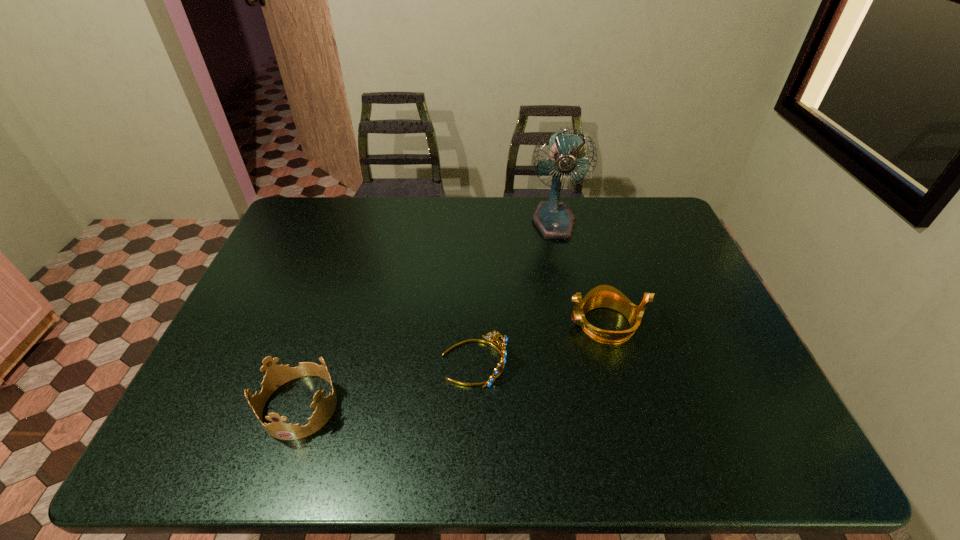
You are a GUI agent. You are given a task and a screenshot of the screen. Output one action in this format:
    pyautogui.click(x=<x>, y=<y>)
    Task: Click on the object located in the far edge section of the desktop
    This screenshot has height=540, width=960.
    Given the screenshot: What is the action you would take?
    pyautogui.click(x=554, y=220)

Locate an element on the screen. The image size is (960, 540). object that is at the near edge is located at coordinates (276, 375).

Identify the location of free spot at the far edge of the desktop. This screenshot has width=960, height=540. (433, 205).

Identify the location of vacant space at the near edge of the desktop. The image size is (960, 540). (423, 427).

Identify the location of blank space at the left edge. (295, 265).

Where is `vacant space at the right edge of the desktop`? This screenshot has height=540, width=960. vacant space at the right edge of the desktop is located at coordinates (659, 303).

The image size is (960, 540). I want to click on vacant space at the far right corner, so click(x=656, y=231).

At what (x,y) coordinates should I click in order to perform the action: click on unoccupied position between the rightmost tiara and the second object from left to right. Please return your answer as a coordinate pair (x, y). Image resolution: width=960 pixels, height=540 pixels. Looking at the image, I should click on (540, 343).

The height and width of the screenshot is (540, 960). Identify the location of free space between the fan and the rightmost tiara. (580, 273).

Where is `free space between the second tiara from right to left and the fan`? Image resolution: width=960 pixels, height=540 pixels. free space between the second tiara from right to left and the fan is located at coordinates (514, 292).